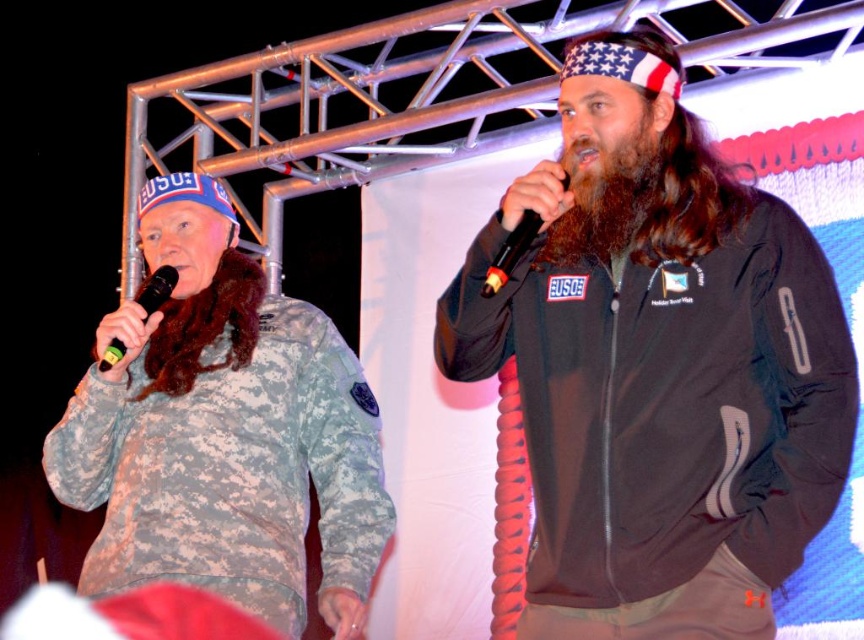
Is black matte jacket at center above camouflage sweatshirt at left?

Yes, black matte jacket at center is above camouflage sweatshirt at left.

Looking at this image, does black matte jacket at center have a lesser height compared to camouflage sweatshirt at left?

Correct, black matte jacket at center is not as tall as camouflage sweatshirt at left.

Is point (650, 360) closer to camera compared to point (380, 520)?

Yes, point (650, 360) is closer to viewer.

Identify the location of black matte jacket at center. (658, 365).

Is camouflage sweatshirt at left taller than black matte microphone at left?

Yes.

Does camouflage sweatshirt at left have a lesser height compared to black matte microphone at left?

Incorrect, camouflage sweatshirt at left's height does not fall short of black matte microphone at left's.

Is point (135, 371) less distant than point (124, 348)?

No.

The image size is (864, 640). Identify the location of camouflage sweatshirt at left. (224, 433).

Does camouflage sweatshirt at left appear under black plastic microphone at center?

Correct, camouflage sweatshirt at left is located below black plastic microphone at center.

Which is more to the right, camouflage sweatshirt at left or black plastic microphone at center?

From the viewer's perspective, black plastic microphone at center appears more on the right side.

Measure the distance between point [119,493] and camera.

Point [119,493] and camera are 3.36 meters apart from each other.

Locate an element on the screen. The width and height of the screenshot is (864, 640). camouflage sweatshirt at left is located at coordinates (224, 433).